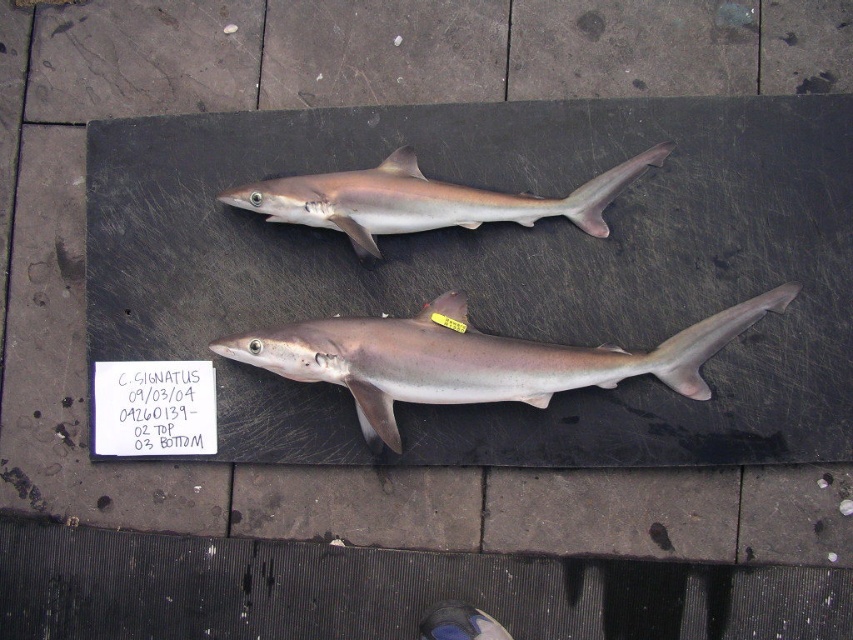
Question: Which object is closer to the camera taking this photo?

Choices:
 (A) smooth gray shark at upper center
 (B) white paper at center
 (C) smooth gray shark at center

Answer: (C)

Question: Is smooth gray shark at upper center positioned at the back of white paper at center?

Choices:
 (A) yes
 (B) no

Answer: (B)

Question: Is smooth gray shark at center to the right of white paper at center from the viewer's perspective?

Choices:
 (A) yes
 (B) no

Answer: (A)

Question: Which point is closer to the camera?

Choices:
 (A) smooth gray shark at center
 (B) white paper at center

Answer: (A)

Question: Among these objects, which one is farthest from the camera?

Choices:
 (A) smooth gray shark at upper center
 (B) smooth gray shark at center

Answer: (A)

Question: Is smooth gray shark at center smaller than smooth gray shark at upper center?

Choices:
 (A) yes
 (B) no

Answer: (B)